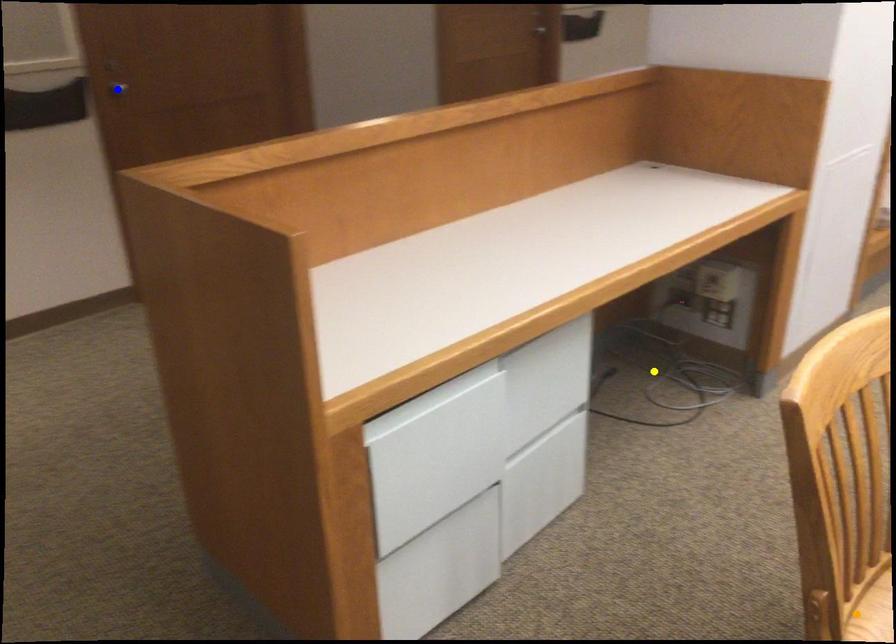
Order these from nearest to farthest:
yellow point, blue point, orange point

orange point, yellow point, blue point